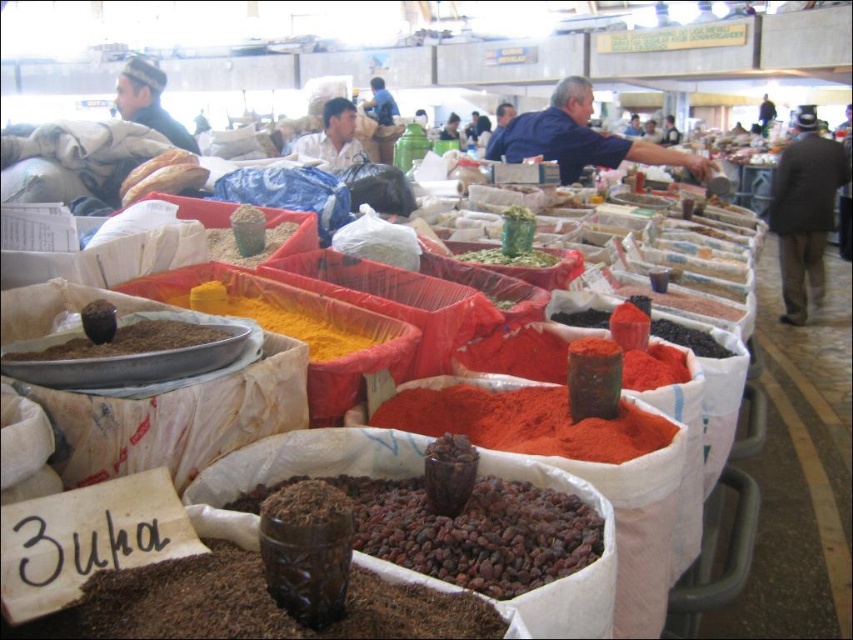
Is point (529, 579) farther from viewer compared to point (647, 364)?

No, (529, 579) is in front of (647, 364).

Can you confirm if dark brown textured seeds at center is smaller than bright red powder at center?

Correct, dark brown textured seeds at center occupies less space than bright red powder at center.

Who is more distant from viewer, (570, 570) or (549, 378)?

The point (549, 378) is behind.

Image resolution: width=853 pixels, height=640 pixels. What are the coordinates of `dark brown textured seeds at center` in the screenshot? It's located at (476, 532).

Is point (514, 433) positioned in front of point (550, 356)?

Yes.

Is the position of bright orange powder at center more distant than that of bright red powder at center?

No, it is in front of bright red powder at center.

Which is in front, point (433, 419) or point (496, 330)?

Point (433, 419) is more forward.

Where is `bright orange powder at center`? The height and width of the screenshot is (640, 853). bright orange powder at center is located at coordinates (524, 420).

Can you confirm if brown matte spice at center is smaller than yellow powder at center?

Indeed, brown matte spice at center has a smaller size compared to yellow powder at center.

What do you see at coordinates (126, 340) in the screenshot? Image resolution: width=853 pixels, height=640 pixels. I see `brown matte spice at center` at bounding box center [126, 340].

This screenshot has height=640, width=853. What do you see at coordinates (126, 340) in the screenshot? I see `brown matte spice at center` at bounding box center [126, 340].

This screenshot has height=640, width=853. I want to click on brown matte spice at center, so click(x=126, y=340).